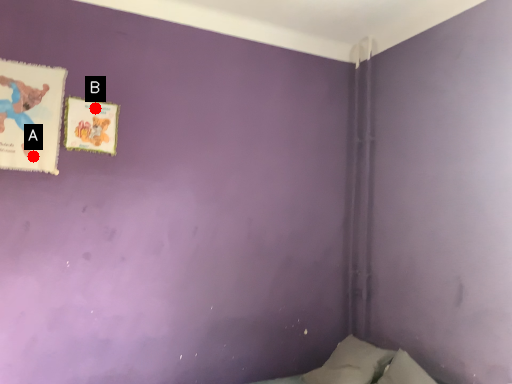
Question: Two points are circled on the image, labeled by A and B beside each circle. Which point is farther to the camera?

Choices:
 (A) A is further
 (B) B is further

Answer: (B)